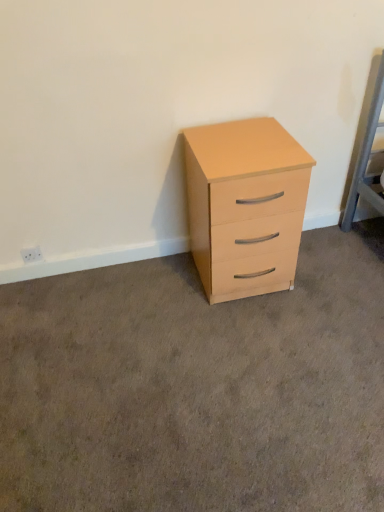
Where is `vacant space situated above light wood/finish chest of drawers at center (from a real-world perspective)`? vacant space situated above light wood/finish chest of drawers at center (from a real-world perspective) is located at coordinates (252, 135).